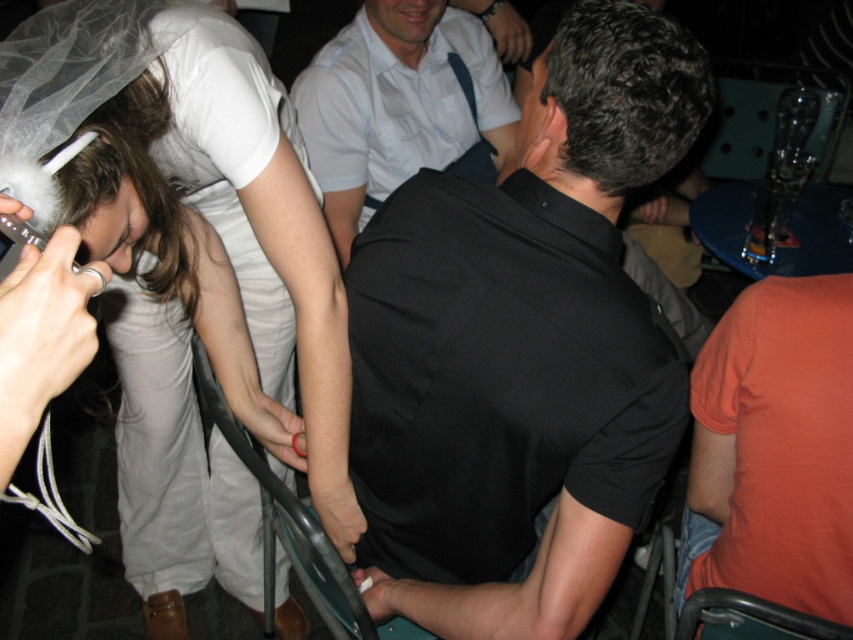
Can you confirm if white matte dress at upper left is taller than white shirt at center?

Correct, white matte dress at upper left is much taller as white shirt at center.

At what (x,y) coordinates should I click in order to perform the action: click on white matte dress at upper left. Please return your answer as a coordinate pair (x, y). The image size is (853, 640). Looking at the image, I should click on (189, 268).

Locate an element on the screen. white matte dress at upper left is located at coordinates (189, 268).

Does point (611, 499) come behind point (503, 156)?

No, it is in front of (503, 156).

Where is `black smooth shirt at center`? black smooth shirt at center is located at coordinates (523, 346).

Between white matte dress at upper left and orange cotton shirt at right, which one appears on the right side from the viewer's perspective?

From the viewer's perspective, orange cotton shirt at right appears more on the right side.

Between white matte dress at upper left and orange cotton shirt at right, which one appears on the left side from the viewer's perspective?

white matte dress at upper left

At what (x,y) coordinates should I click in order to perform the action: click on white matte dress at upper left. Please return your answer as a coordinate pair (x, y). Looking at the image, I should click on (189, 268).